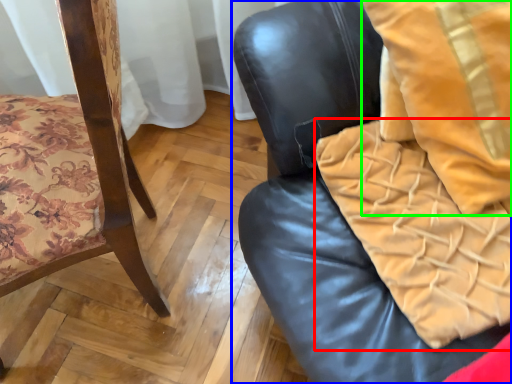
Question: Estimate the real-world distances between objects in this image. Which object is farther from blanket (highlighted by a red box), chair (highlighted by a blue box) or throw pillow (highlighted by a green box)?

Choices:
 (A) chair
 (B) throw pillow

Answer: (B)